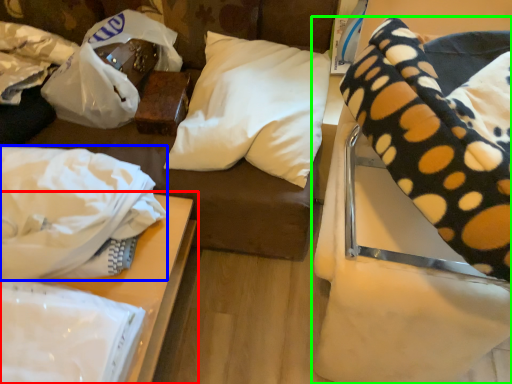
Question: Which object is positioned closest to table (highlighted by a red box)? Select from material (highlighted by a blue box) and furniture (highlighted by a green box).

Choices:
 (A) material
 (B) furniture

Answer: (A)